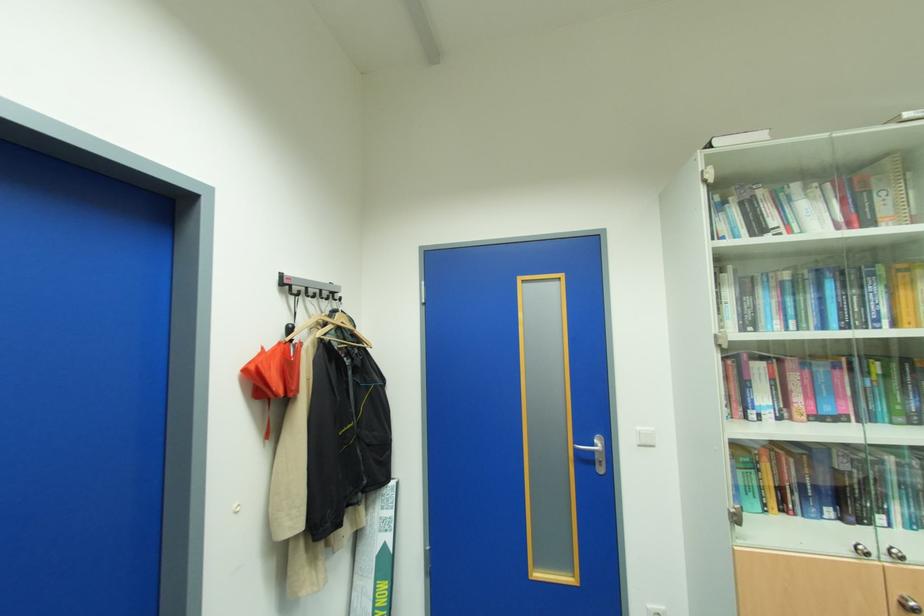
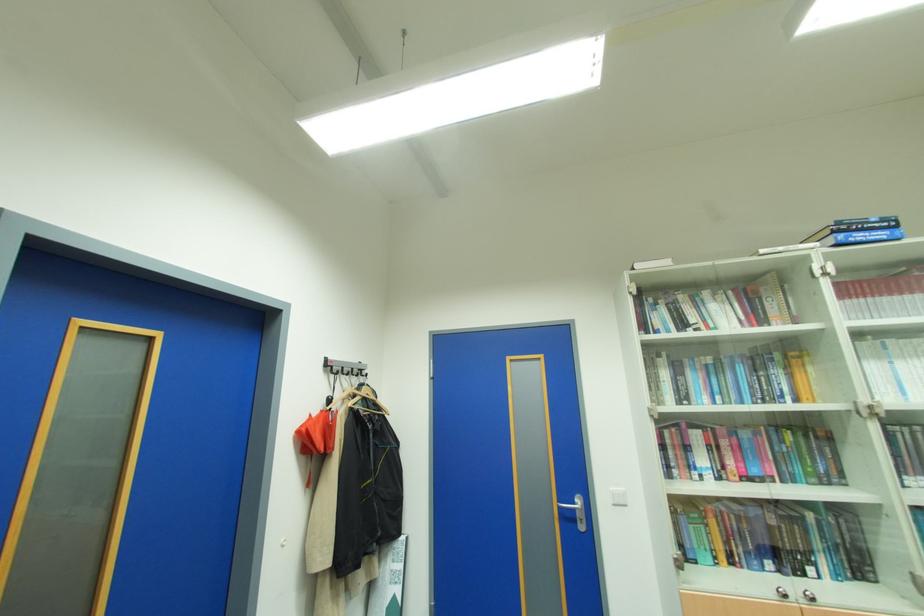
Question: Which direction would the cameraman need to move to produce the second image? Reply with the corresponding letter.

Choices:
 (A) Left
 (B) Right
 (C) Forward
 (D) Backward

Answer: (D)